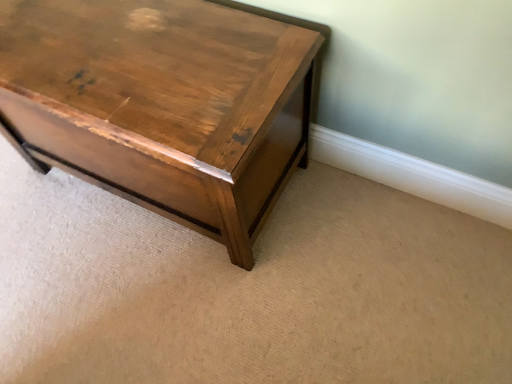
Find the location of a particular element. vacant area that is in front of shiny brown wood table at center is located at coordinates (186, 304).